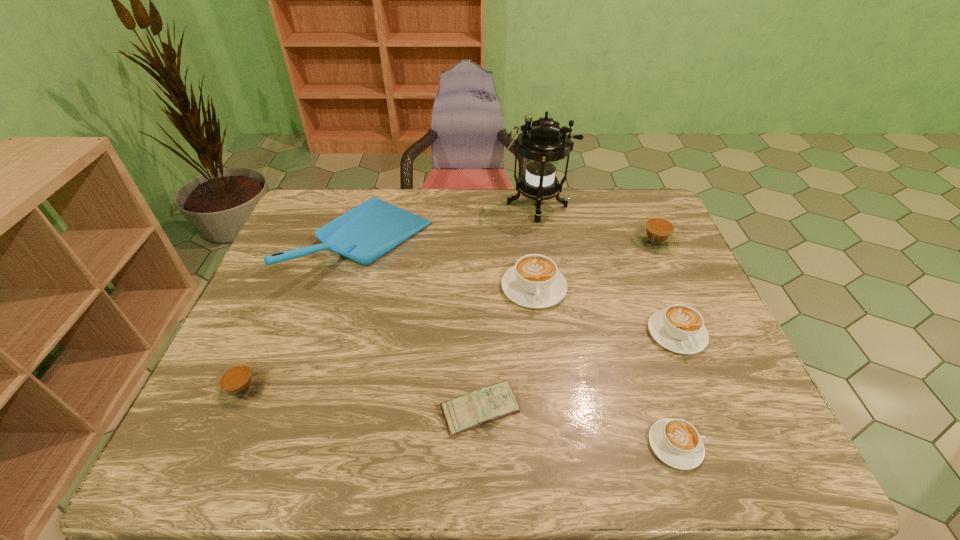
Locate an element on the screen. The height and width of the screenshot is (540, 960). pink diary is located at coordinates (476, 408).

Image resolution: width=960 pixels, height=540 pixels. In order to click on the shortest cappuccino in this screenshot , I will do `click(676, 442)`.

Identify the location of the nearest cappuccino. The image size is (960, 540). (676, 442).

Find the location of a particular element. The width and height of the screenshot is (960, 540). vacant space situated on the front of the black lantern is located at coordinates (542, 237).

Where is `free region located on the front of the second tallest object`? free region located on the front of the second tallest object is located at coordinates (327, 385).

Find the location of a particular element. The width and height of the screenshot is (960, 540). free space located on the left of the bigger brown cappuccino is located at coordinates (615, 241).

The height and width of the screenshot is (540, 960). Find the location of `vacant space located on the side of the leftmost white cappuccino with the handle`. vacant space located on the side of the leftmost white cappuccino with the handle is located at coordinates (552, 441).

The height and width of the screenshot is (540, 960). In order to click on vacant point located 0.090m on the side of the second biggest white cappuccino with the handle in this screenshot , I will do `click(700, 390)`.

This screenshot has height=540, width=960. What are the coordinates of `blank space located on the right of the nearer brown cappuccino` in the screenshot? It's located at (338, 388).

Locate an element on the screen. The height and width of the screenshot is (540, 960). vacant space located 0.080m on the back of the diary is located at coordinates (480, 357).